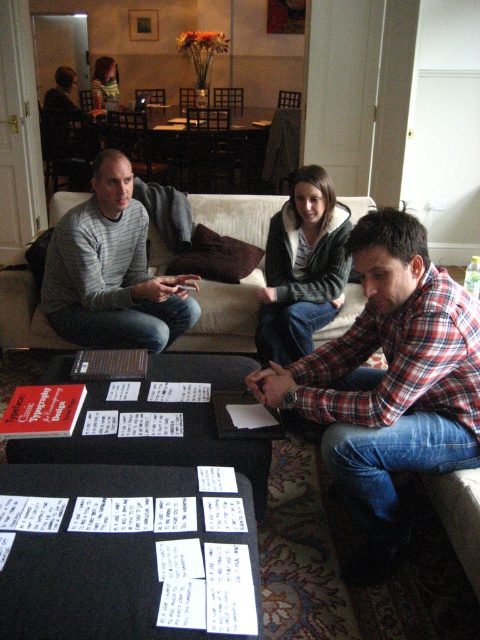
Question: In this image, where is plaid flannel shirt at center located relative to matte gray sweater at center?

Choices:
 (A) below
 (B) above

Answer: (A)

Question: Can you confirm if plaid flannel shirt at center is positioned to the left of striped hoodie at center?

Choices:
 (A) yes
 (B) no

Answer: (B)

Question: Is white paper cards at lower center above beige fabric couch at center?

Choices:
 (A) yes
 (B) no

Answer: (B)

Question: Which of the following is the farthest from the observer?

Choices:
 (A) (213, 522)
 (B) (166, 323)
 (C) (472, 442)
 (D) (282, 346)

Answer: (B)

Question: Among these objects, which one is nearest to the camera?

Choices:
 (A) plaid flannel shirt at center
 (B) striped hoodie at center
 (C) white paper cards at lower center
 (D) matte gray sweater at center

Answer: (C)

Question: Which of these objects is positioned closest to the matte gray sweater at center?

Choices:
 (A) plaid flannel shirt at center
 (B) white paper cards at lower center
 (C) striped hoodie at center

Answer: (C)